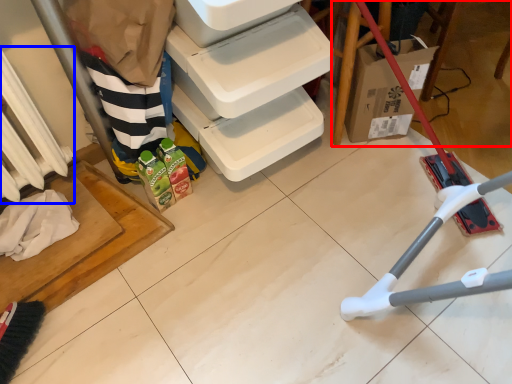
Question: Which point is closer to the camera, furniture (highlighted by a red box) or radiator (highlighted by a blue box)?

Choices:
 (A) furniture
 (B) radiator

Answer: (B)